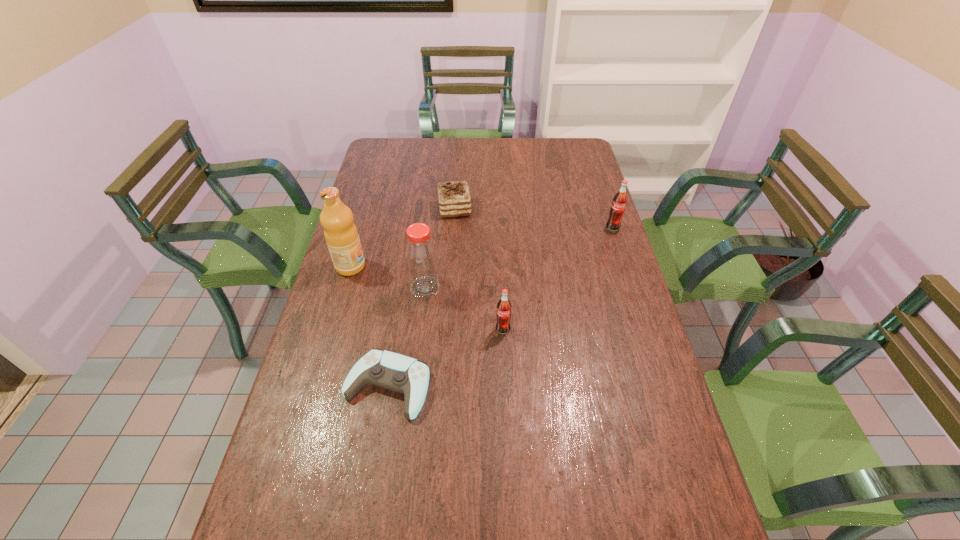
The soda bottles are evenly distributed in the image. To maintain this, where would you place another soda bottle on the left? Please point to a free space. Please provide its 2D coordinates. Your answer should be formatted as a tuple, i.e. [(x, y)], where the tuple contains the x and y coordinates of a point satisfying the conditions above.

[(320, 498)]